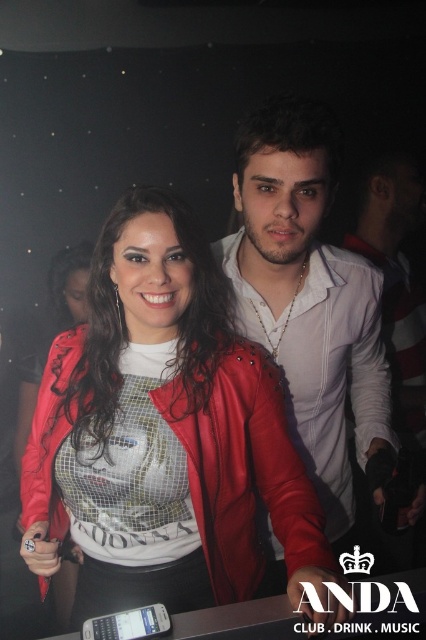
You are a photographer adjusting your camera settings to capture the two central items in the scene. The shiny red leather jacket at center and the matte white shirt at center are both in focus. Which item appears shorter in the photo?

The shiny red leather jacket at center appears shorter than the matte white shirt at center because it has a lesser height compared to it.

You are a photographer trying to capture the perfect shot of the shiny red leather jacket at center and the matte white shirt at center. Since the lighting is tricky, you want to ensure both are visible. Which object should you focus on first to get the best exposure for both?

The shiny red leather jacket at center is below the matte white shirt at center, so focusing on the matte white shirt at center first will help balance the exposure since it is positioned higher and may receive more ambient light in the dim setting.